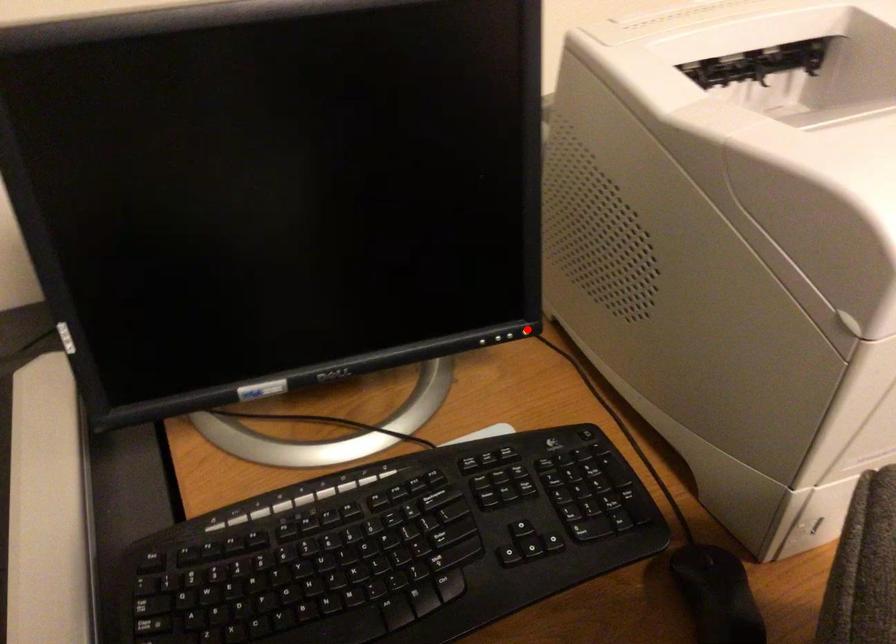
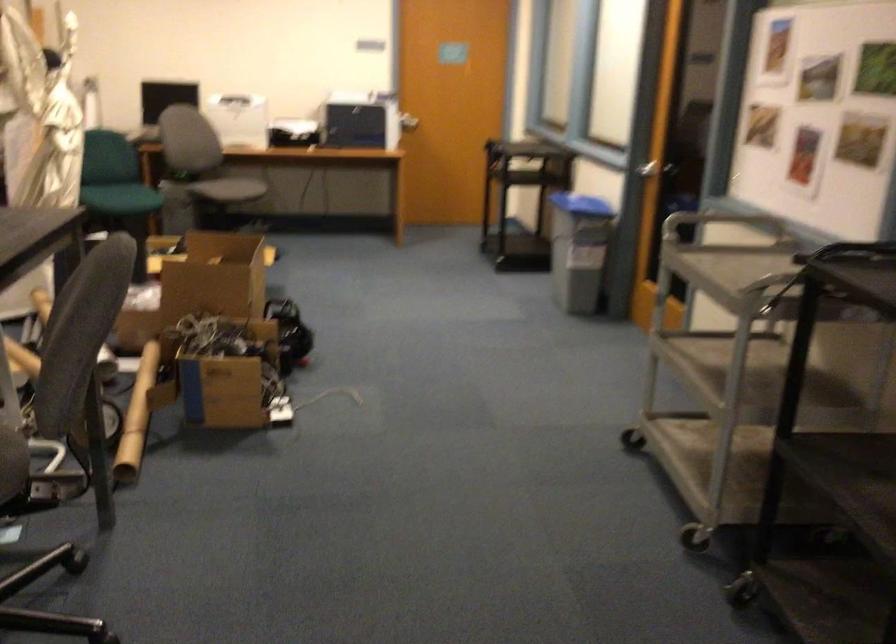
Question: I am providing you with two images of the same scene from different viewpoints. A red point is marked on the first image. Can you still see the location of the red point in image 2?

Choices:
 (A) Yes
 (B) No

Answer: (B)